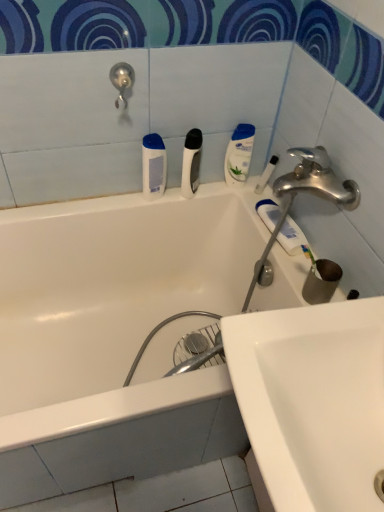
I want to click on vacant region to the left of white matte bottle at upper center, which is the fourth toiletry from right to left, so click(112, 199).